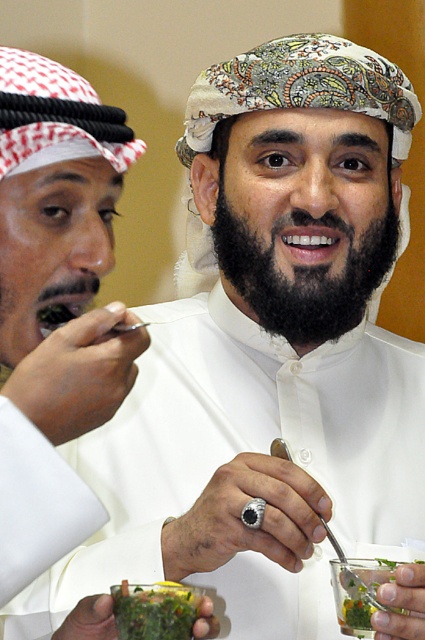
Question: Which object is the farthest from the green leafy salad at lower right?

Choices:
 (A) black matte beard at center
 (B) green leafy salad at center

Answer: (A)

Question: Which is farther from the green leafy salad at center?

Choices:
 (A) black matte beard at center
 (B) green leafy salad at lower right

Answer: (A)

Question: Which point is closer to the camera?

Choices:
 (A) (422, 563)
 (B) (260, 312)
 (C) (181, 598)

Answer: (C)

Question: Does black matte beard at center appear on the left side of green leafy salad at lower right?

Choices:
 (A) yes
 (B) no

Answer: (A)

Question: Does black matte beard at center lie behind green leafy salad at center?

Choices:
 (A) no
 (B) yes

Answer: (B)

Question: Can you confirm if black matte beard at center is positioned to the right of green leafy salad at lower right?

Choices:
 (A) no
 (B) yes

Answer: (A)